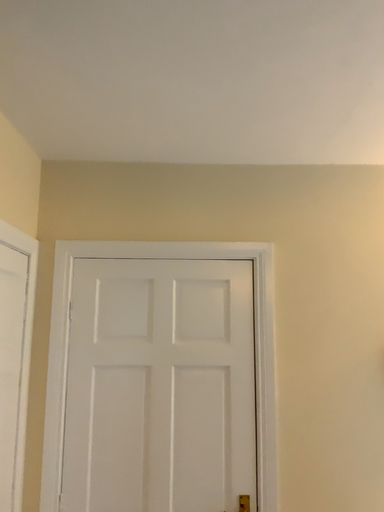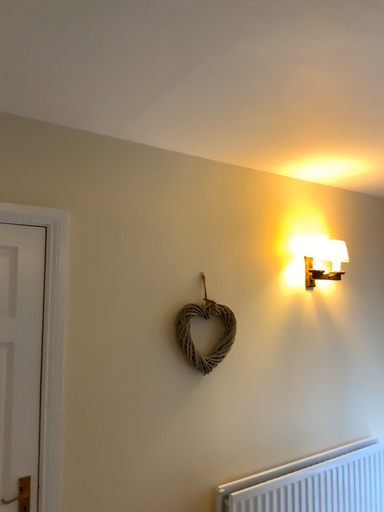
Question: How did the camera likely rotate when shooting the video?

Choices:
 (A) rotated right
 (B) rotated left

Answer: (A)